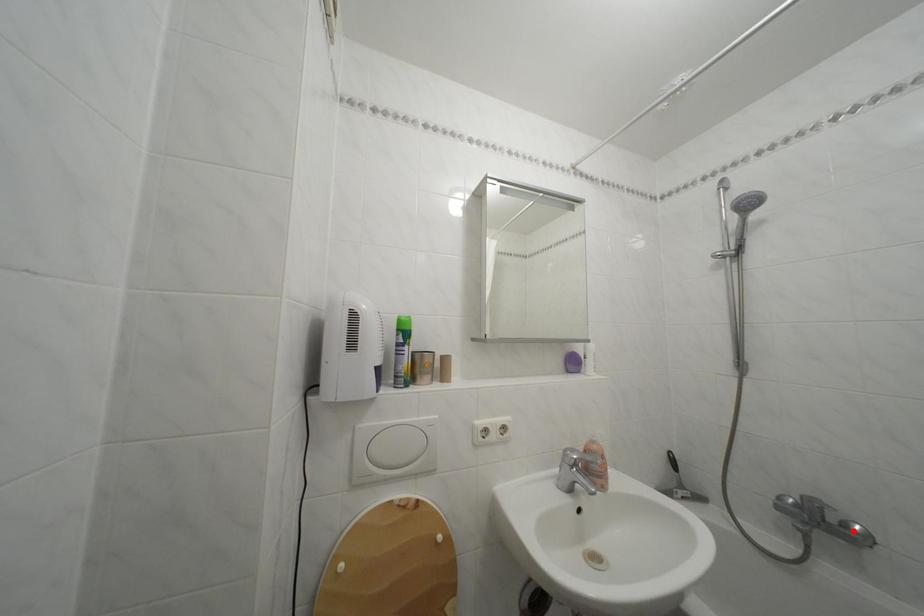
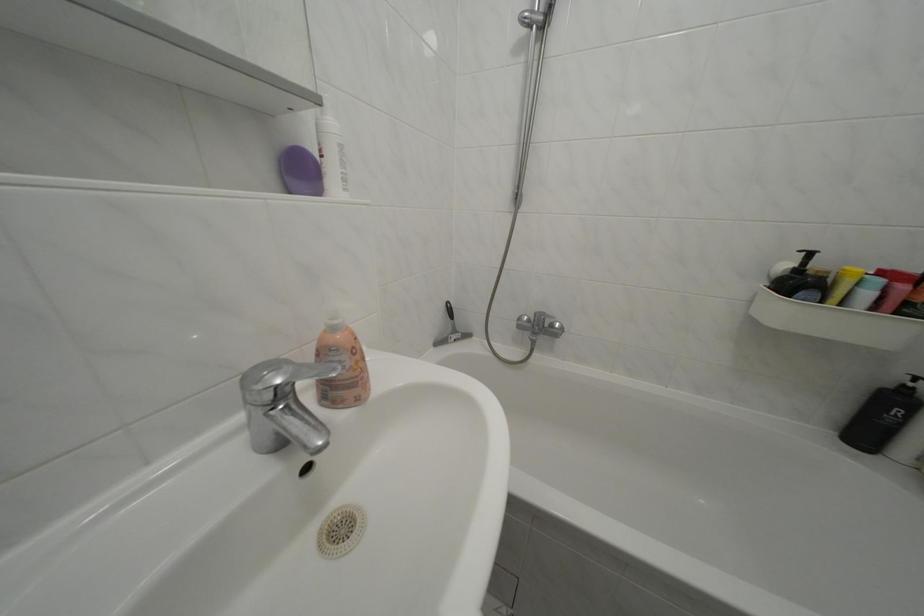
Question: I am providing you with two images of the same scene from different viewpoints. Given a red point in image1, look at the same physical point in image2. Is it:

Choices:
 (A) Closer to the viewpoint
 (B) Farther from the viewpoint

Answer: (B)